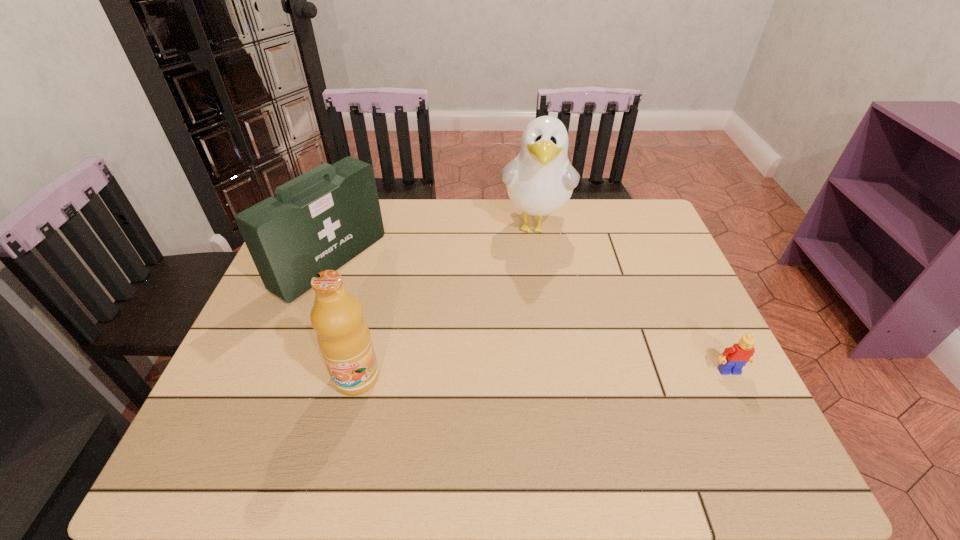
Where is `blank space located 0.060m on the front-facing side of the first-aid kit`? This screenshot has width=960, height=540. blank space located 0.060m on the front-facing side of the first-aid kit is located at coordinates (379, 295).

I want to click on free space located 0.110m on the front-facing side of the first-aid kit, so click(393, 302).

You are a GUI agent. You are given a task and a screenshot of the screen. Output one action in this format:
    pyautogui.click(x=<x>, y=<y>)
    Task: Click on the vacant space located 0.320m on the front-facing side of the first-aid kit
    
    Given the screenshot: What is the action you would take?
    pyautogui.click(x=457, y=339)

At what (x,y) coordinates should I click in order to perform the action: click on gull that is at the far edge. Please return your answer as a coordinate pair (x, y). Looking at the image, I should click on (540, 180).

Image resolution: width=960 pixels, height=540 pixels. I want to click on the first-aid kit present at the far edge, so click(322, 219).

Locate an element on the screen. object that is at the near edge is located at coordinates (343, 336).

This screenshot has width=960, height=540. Find the location of `object located in the left edge section of the desktop`. object located in the left edge section of the desktop is located at coordinates (322, 219).

Locate an element on the screen. Image resolution: width=960 pixels, height=540 pixels. object that is positioned at the right edge is located at coordinates (733, 359).

You are a GUI agent. You are given a task and a screenshot of the screen. Output one action in this format:
    pyautogui.click(x=<x>, y=<y>)
    Task: Click on the object that is at the far left corner
    This screenshot has width=960, height=540.
    Given the screenshot: What is the action you would take?
    pyautogui.click(x=322, y=219)

In the image, there is a desktop. Identify the location of vacant space at the far edge. Image resolution: width=960 pixels, height=540 pixels. (461, 213).